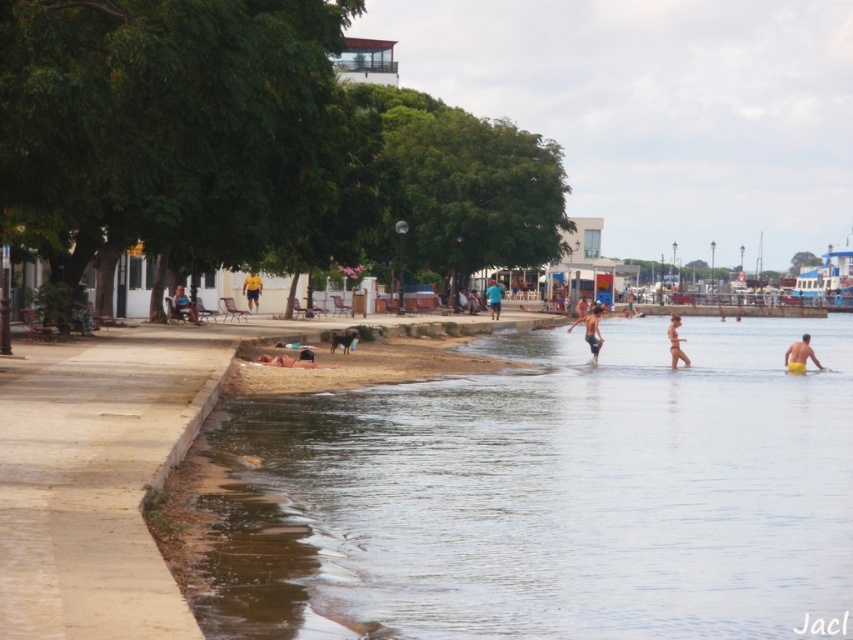
You are standing on the walkway next to the river. There is a clear water at lower center marked by point (548, 493). Can you see the clear water at lower center from your current position?

Answer: Yes, the clear water at lower center is located at point (548, 493), which is within the visible area from the walkway.

You are standing on the riverside walkway and see the clear water at lower center and the dark brown leather bag at lower center. Which object is closer to the ground?

The clear water at lower center is closer to the ground because it is below the dark brown leather bag at lower center.

You are standing at the center of the image and want to walk to the clear water at lower center. Which direction should you move to reach it?

Since the clear water at lower center is located at point (548, 493), you should move downward and to the right from the center to reach it.